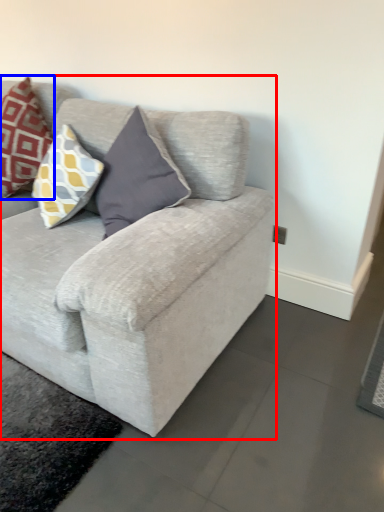
Question: Which object appears farthest to the camera in this image, studio couch (highlighted by a red box) or pillow (highlighted by a blue box)?

Choices:
 (A) studio couch
 (B) pillow

Answer: (B)